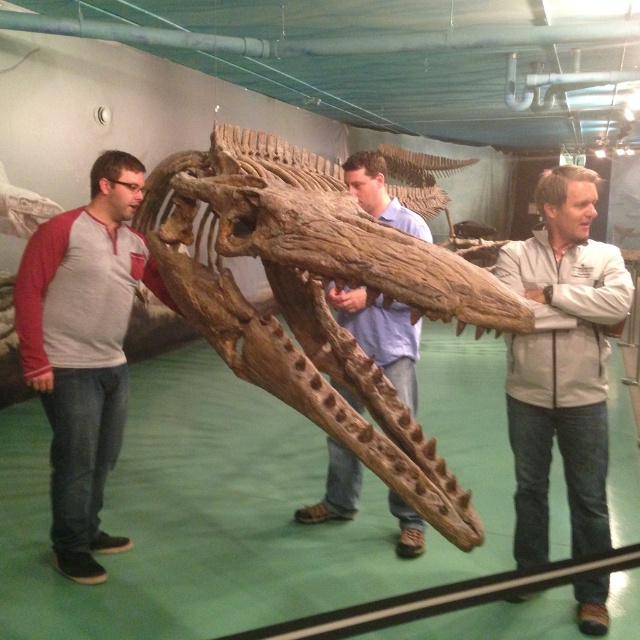
Does brown rough skull at center have a greater height compared to white matte jacket at center?

Indeed, brown rough skull at center has a greater height compared to white matte jacket at center.

Can you confirm if brown rough skull at center is positioned below white matte jacket at center?

No.

The width and height of the screenshot is (640, 640). In order to click on brown rough skull at center in this screenshot , I will do `click(312, 298)`.

Can you confirm if brown rough skull at center is positioned above wooden skull at center?

Correct, brown rough skull at center is located above wooden skull at center.

From the picture: Which of these two, brown rough skull at center or wooden skull at center, stands shorter?

Standing shorter between the two is wooden skull at center.

Who is more distant from viewer, [228,161] or [353,497]?

The point [353,497] is more distant.

Image resolution: width=640 pixels, height=640 pixels. I want to click on brown rough skull at center, so click(312, 298).

Does white matte jacket at center have a greater height compared to wooden skull at center?

Indeed, white matte jacket at center has a greater height compared to wooden skull at center.

Can you confirm if white matte jacket at center is positioned above wooden skull at center?

Actually, white matte jacket at center is below wooden skull at center.

Between point (518, 448) and point (374, 307), which one is positioned in front?

Point (518, 448)

Locate an element on the screen. The image size is (640, 640). white matte jacket at center is located at coordinates (561, 364).